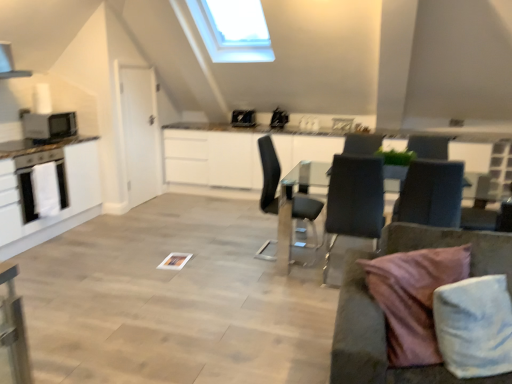
Question: From the image's perspective, is pink fabric pillow at lower right over matte black microwave at left, the first appliance from the front?

Choices:
 (A) yes
 (B) no

Answer: (B)

Question: Is pink fabric pillow at lower right positioned far away from matte black microwave at left, the 3th appliance when ordered from right to left?

Choices:
 (A) yes
 (B) no

Answer: (A)

Question: Is pink fabric pillow at lower right smaller than matte black microwave at left, the 3th appliance when ordered from right to left?

Choices:
 (A) no
 (B) yes

Answer: (A)

Question: Considering the relative positions of pink fabric pillow at lower right and matte black microwave at left, the 3th appliance when ordered from right to left, in the image provided, is pink fabric pillow at lower right to the left of matte black microwave at left, the 3th appliance when ordered from right to left, from the viewer's perspective?

Choices:
 (A) no
 (B) yes

Answer: (A)

Question: Does pink fabric pillow at lower right turn towards matte black microwave at left, the first appliance from the front?

Choices:
 (A) no
 (B) yes

Answer: (A)

Question: Considering the relative sizes of pink fabric pillow at lower right and matte black microwave at left, positioned as the 1th appliance in left-to-right order, in the image provided, is pink fabric pillow at lower right thinner than matte black microwave at left, positioned as the 1th appliance in left-to-right order,?

Choices:
 (A) no
 (B) yes

Answer: (B)

Question: Can you confirm if dark gray fabric chair at center, the 3th chair positioned from the left, is smaller than black leather chair at center, the 1th chair viewed from the left?

Choices:
 (A) no
 (B) yes

Answer: (B)

Question: Is dark gray fabric chair at center, the 1th chair in the right-to-left sequence, looking in the opposite direction of black leather chair at center, which is the 3th chair in right-to-left order?

Choices:
 (A) no
 (B) yes

Answer: (A)

Question: Is dark gray fabric chair at center, the 3th chair positioned from the left, wider than black leather chair at center, the 1th chair viewed from the left?

Choices:
 (A) no
 (B) yes

Answer: (B)

Question: Does dark gray fabric chair at center, the 3th chair positioned from the left, appear on the right side of black leather chair at center, the 1th chair viewed from the left?

Choices:
 (A) yes
 (B) no

Answer: (A)

Question: Does dark gray fabric chair at center, the 1th chair in the right-to-left sequence, have a lesser height compared to black leather chair at center, which is the 3th chair in right-to-left order?

Choices:
 (A) no
 (B) yes

Answer: (B)

Question: From a real-world perspective, is dark gray fabric chair at center, the 3th chair positioned from the left, under black leather chair at center, which is the 3th chair in right-to-left order?

Choices:
 (A) yes
 (B) no

Answer: (B)

Question: Can we say satin black laptop at upper center, which is the first appliance in right-to-left order, lies outside black leather chair at center, the 1th chair viewed from the left?

Choices:
 (A) yes
 (B) no

Answer: (A)